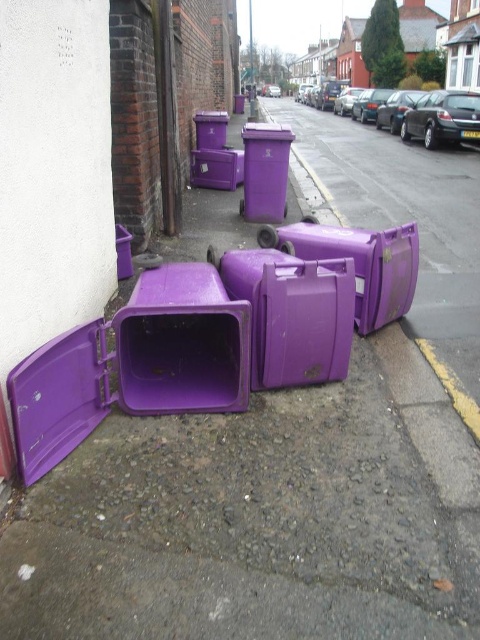
Based on the photo, you are a delivery person carrying a package that measures 1.5 meters in length. You need to navigate through the space between the purple plastic bin at center and the matte plastic trash can at center. Can you pass through this space without tilting the package?

The distance between the purple plastic bin at center and the matte plastic trash can at center is 1.32 meters. Since the package is 1.5 meters long, it is longer than the available space. Therefore, you cannot pass through without tilting or repositioning the package.

You are a delivery person trying to determine which container is shorter to place a small package. You see the purple plastic bin at center and the matte plastic trash can at center. Which one is shorter?

The purple plastic bin at center is shorter than the matte plastic trash can at center, so you should place the small package in the purple plastic bin at center.

You are standing at the point marked by the coordinates (359, 262) on the image. What object are you standing on?

The point marked by the coordinates (359, 262) indicates the purple plastic bin at center.